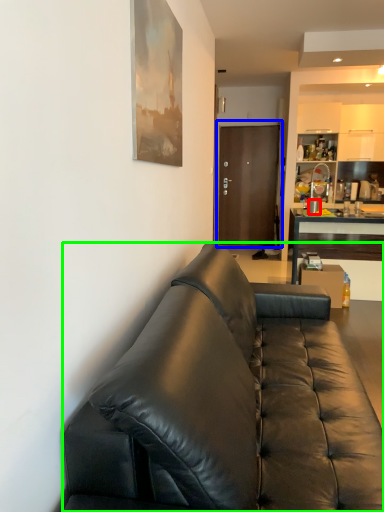
Question: Which is farther away from coffee cup (highlighted by a red box)? door (highlighted by a blue box) or studio couch (highlighted by a green box)?

Choices:
 (A) door
 (B) studio couch

Answer: (B)